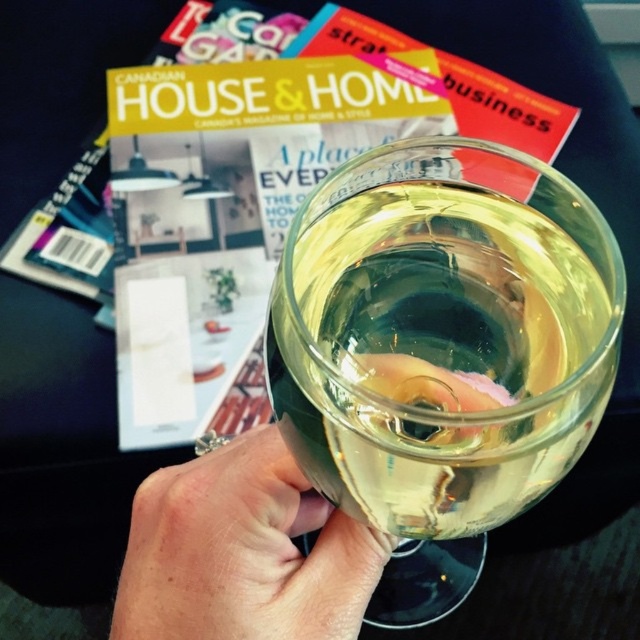
Who is positioned more to the right, translucent glass at center or matte paper magazine at upper center?

matte paper magazine at upper center is more to the right.

Can you confirm if translucent glass at center is wider than matte paper magazine at upper center?

Incorrect, translucent glass at center's width does not surpass matte paper magazine at upper center's.

Locate an element on the screen. translucent glass at center is located at coordinates (243, 552).

At what (x,y) coordinates should I click in order to perform the action: click on translucent glass at center. Please return your answer as a coordinate pair (x, y). The width and height of the screenshot is (640, 640). Looking at the image, I should click on (243, 552).

Can you confirm if transparent glass at center is taller than translucent glass at center?

Indeed, transparent glass at center has a greater height compared to translucent glass at center.

Between transparent glass at center and translucent glass at center, which one has less height?

Standing shorter between the two is translucent glass at center.

Who is more distant from viewer, (504, 378) or (237, 440)?

Point (237, 440)

Where is `transparent glass at center`? transparent glass at center is located at coordinates (442, 333).

Is transparent glass at center shorter than matte paper magazine at upper center?

Indeed, transparent glass at center has a lesser height compared to matte paper magazine at upper center.

Is transparent glass at center to the left of matte paper magazine at upper center from the viewer's perspective?

In fact, transparent glass at center is to the right of matte paper magazine at upper center.

Measure the distance between transparent glass at center and camera.

5.63 inches

Image resolution: width=640 pixels, height=640 pixels. Identify the location of transparent glass at center. (442, 333).